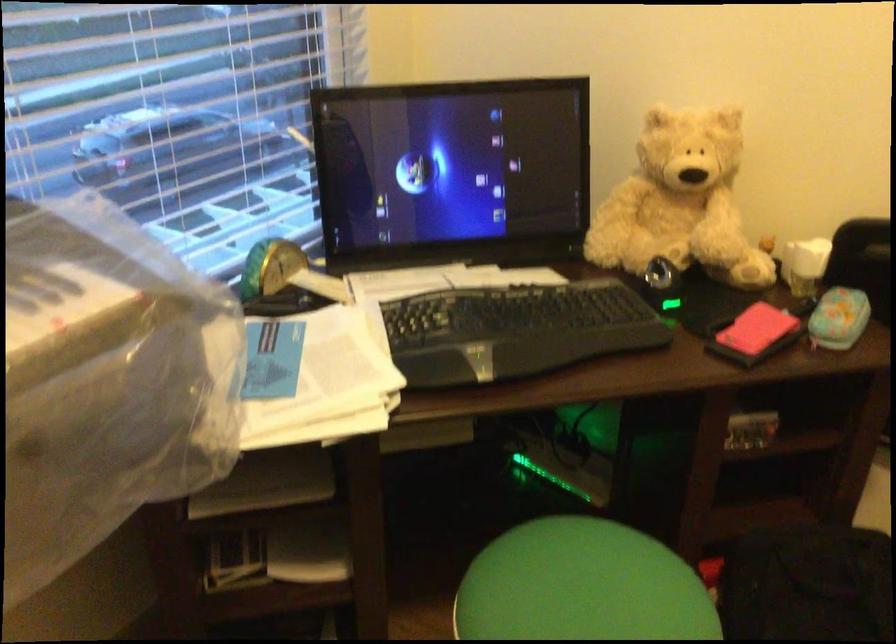
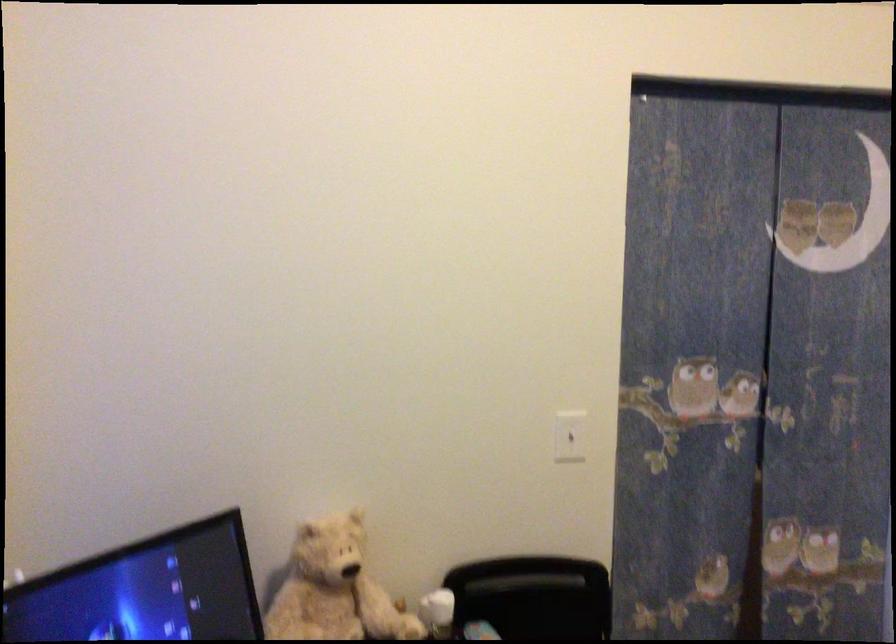
Question: The camera is either moving clockwise (left) or counter-clockwise (right) around the object. The first image is from the beginning of the video and the second image is from the end. Is the camera moving left or right when shooting the video?

Choices:
 (A) Left
 (B) Right

Answer: (A)